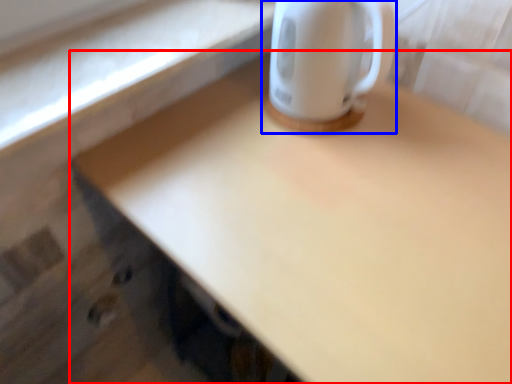
Question: Which of the following is the farthest to the observer, desk (highlighted by a red box) or coffee cup (highlighted by a blue box)?

Choices:
 (A) desk
 (B) coffee cup

Answer: (B)